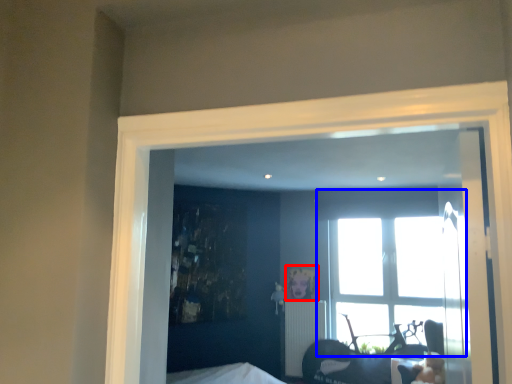
Question: Among these objects, which one is farthest to the camera, picture frame (highlighted by a red box) or window (highlighted by a blue box)?

Choices:
 (A) picture frame
 (B) window

Answer: (A)